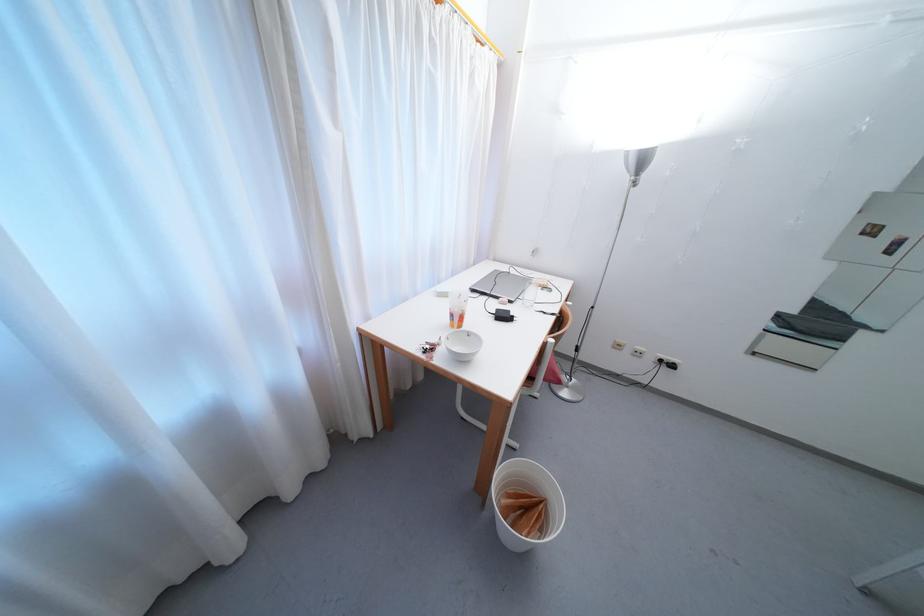
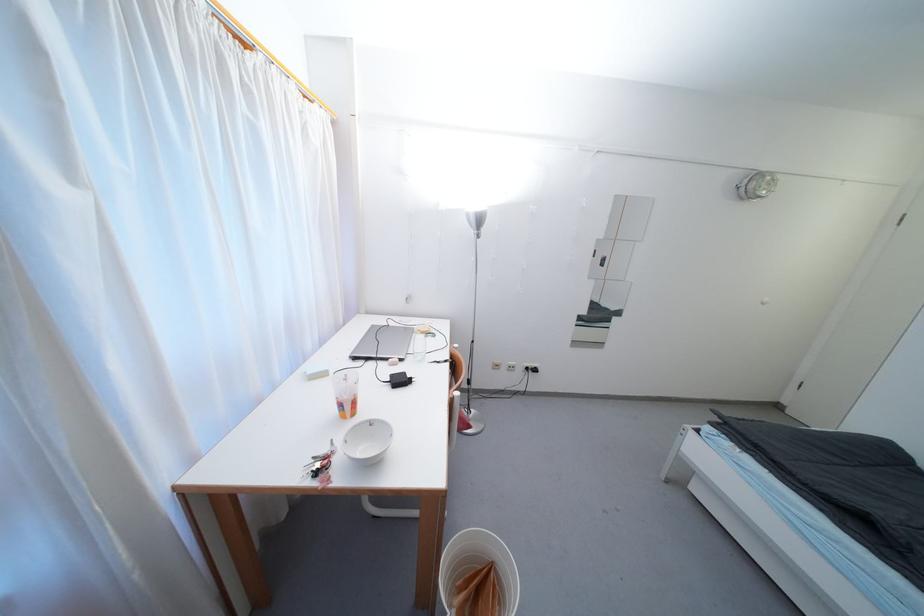
The point at (551, 508) is marked in the first image. Where is the corresponding point in the second image?

(499, 572)